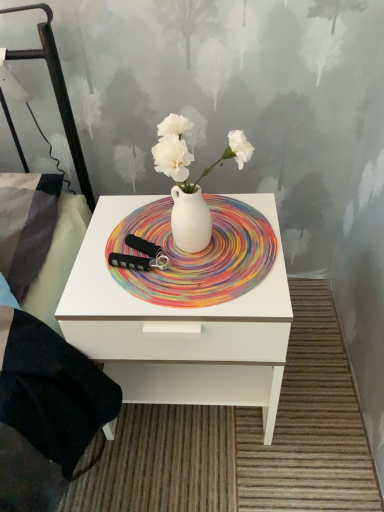
Locate an element on the screen. This screenshot has width=384, height=512. free space in front of white matte vase at center is located at coordinates (211, 289).